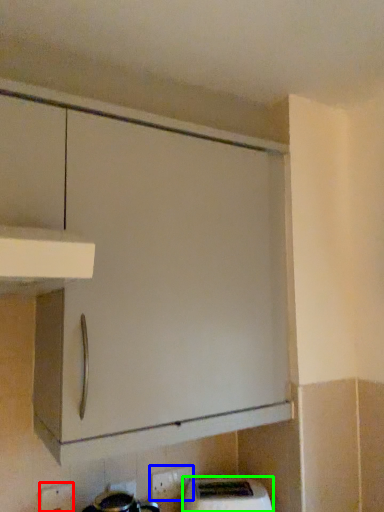
Question: Which object is positioned closest to electric outlet (highlighted by a red box)? Select from electric outlet (highlighted by a blue box) and home appliance (highlighted by a green box).

Choices:
 (A) electric outlet
 (B) home appliance

Answer: (A)